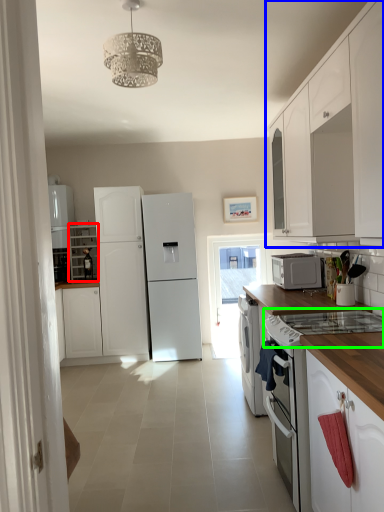
Question: Which object is the closest to the cabinetry (highlighted by a red box)? Choose among these: cabinetry (highlighted by a blue box) or gas stove (highlighted by a green box).

Choices:
 (A) cabinetry
 (B) gas stove

Answer: (A)